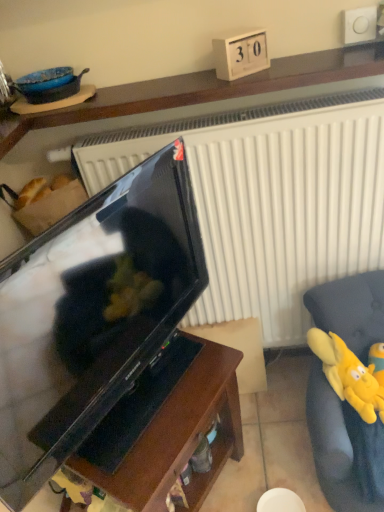
Question: Can you confirm if yellow plush toy at right is shorter than matte black television at center?

Choices:
 (A) yes
 (B) no

Answer: (A)

Question: From the image's perspective, would you say yellow plush toy at right is shown under matte black television at center?

Choices:
 (A) yes
 (B) no

Answer: (A)

Question: Does yellow plush toy at right have a smaller size compared to matte black television at center?

Choices:
 (A) no
 (B) yes

Answer: (B)

Question: From a real-world perspective, is yellow plush toy at right positioned under matte black television at center based on gravity?

Choices:
 (A) yes
 (B) no

Answer: (A)

Question: Is yellow plush toy at right in contact with matte black television at center?

Choices:
 (A) no
 (B) yes

Answer: (A)

Question: Considering the positions of black glossy tv stand at center, which is the third furniture in top-to-bottom order, and wooden shelf at upper center, the third furniture in the bottom-to-top sequence, in the image, is black glossy tv stand at center, which is the third furniture in top-to-bottom order, bigger or smaller than wooden shelf at upper center, the third furniture in the bottom-to-top sequence,?

Choices:
 (A) small
 (B) big

Answer: (B)

Question: Is black glossy tv stand at center, arranged as the 1th furniture when ordered from the bottom, inside the boundaries of wooden shelf at upper center, which ranks as the 1th furniture in top-to-bottom order, or outside?

Choices:
 (A) inside
 (B) outside

Answer: (B)

Question: Is black glossy tv stand at center, arranged as the 1th furniture when ordered from the bottom, taller or shorter than wooden shelf at upper center, which ranks as the 1th furniture in top-to-bottom order?

Choices:
 (A) short
 (B) tall

Answer: (B)

Question: Considering their positions, is black glossy tv stand at center, which is the third furniture in top-to-bottom order, located in front of or behind wooden shelf at upper center, the third furniture in the bottom-to-top sequence?

Choices:
 (A) front
 (B) behind

Answer: (A)

Question: Would you say yellow plush toy at right is to the left or to the right of yellow plush toy at right, which is counted as the 2th furniture, starting from the bottom, in the picture?

Choices:
 (A) right
 (B) left

Answer: (B)

Question: From their relative heights in the image, would you say yellow plush toy at right is taller or shorter than yellow plush toy at right, the second furniture when ordered from top to bottom?

Choices:
 (A) short
 (B) tall

Answer: (A)

Question: From the image's perspective, is yellow plush toy at right located above or below yellow plush toy at right, the second furniture when ordered from top to bottom?

Choices:
 (A) below
 (B) above

Answer: (B)

Question: Is point [380, 401] positioned closer to the camera than point [319, 375]?

Choices:
 (A) farther
 (B) closer

Answer: (B)

Question: Is matte black television at center to the left or to the right of black glossy tv stand at center, which is the third furniture in top-to-bottom order, in the image?

Choices:
 (A) left
 (B) right

Answer: (A)

Question: In the image, is matte black television at center positioned in front of or behind black glossy tv stand at center, which is the third furniture in top-to-bottom order?

Choices:
 (A) behind
 (B) front

Answer: (B)